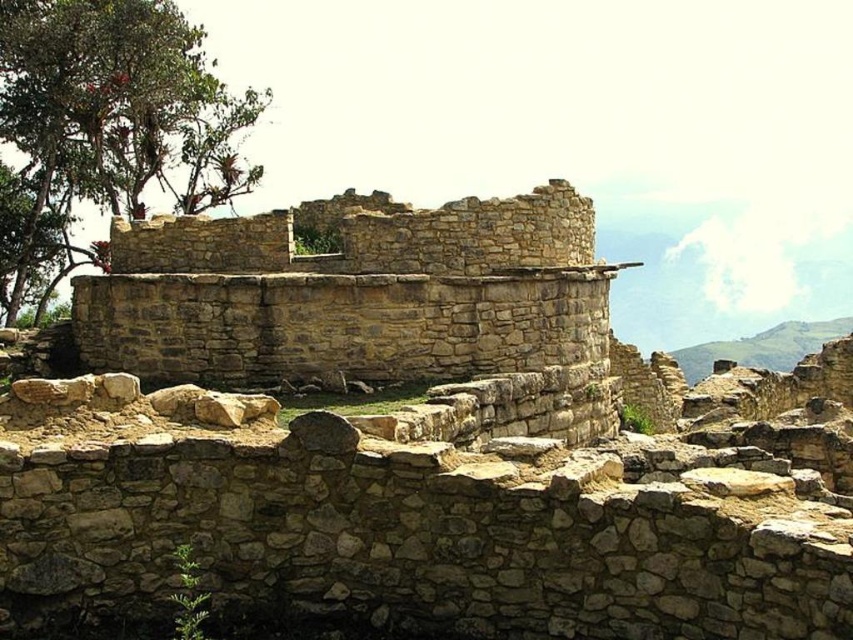
You are standing at the edge of the ancient stone structure and want to take a photo that includes both the natural stone ruins at center and the green leafy tree at upper left. Based on their positions, which object should you position on the right side of your camera frame?

The natural stone ruins at center should be positioned on the right side of your camera frame because it is to the right of the green leafy tree at upper left.

From the picture: You are standing at the point marked by coordinates point (x=413, y=440) in the image. What ancient structure are you currently at the center of?

The point (x=413, y=440) is at the center of the natural stone ruins at center, so you are at the center of the natural stone ruins at center.

You are an archaeologist planning to set up a temporary research station between the natural stone ruins at center and the green leafy tree at upper left. Given that the distance between them is exactly 240.76 feet, what is the minimum distance you need to maintain from each to ensure the station is equidistant from both?

The minimum distance to maintain from each object would be half of 240.76 feet, which is 120.38 feet. This ensures the research station is placed exactly midway between the natural stone ruins at center and the green leafy tree at upper left.